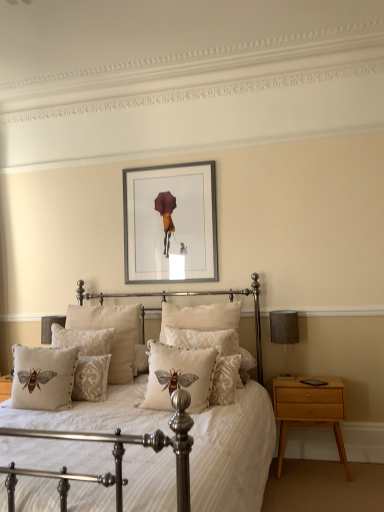
Question: Should I look upward or downward to see light brown wood nightstand at right?

Choices:
 (A) down
 (B) up

Answer: (A)

Question: Is matte white bed at center in front of beige embroidered pillow with bee design at center, which ranks as the 1th pillow in front-to-back order?

Choices:
 (A) yes
 (B) no

Answer: (A)

Question: From the image's perspective, would you say matte white bed at center is positioned over beige embroidered pillow with bee design at center, which ranks as the 1th pillow in front-to-back order?

Choices:
 (A) yes
 (B) no

Answer: (B)

Question: Is matte white bed at center shorter than beige embroidered pillow with bee design at center, which ranks as the 1th pillow in front-to-back order?

Choices:
 (A) no
 (B) yes

Answer: (A)

Question: Can you confirm if matte white bed at center is taller than beige embroidered pillow with bee design at center, which is the sixth pillow from back to front?

Choices:
 (A) no
 (B) yes

Answer: (B)

Question: Is matte white bed at center directly adjacent to beige embroidered pillow with bee design at center, which is the sixth pillow from back to front?

Choices:
 (A) no
 (B) yes

Answer: (A)

Question: Could beige embroidered pillow with bee design at center, which is the sixth pillow from back to front, be considered to be inside matte white bed at center?

Choices:
 (A) no
 (B) yes

Answer: (B)

Question: Considering the relative sizes of white textured pillow with bee design at center, the 3th pillow viewed from the front, and beige damask pillow with bee design at center, positioned as the 4th pillow in front-to-back order, in the image provided, is white textured pillow with bee design at center, the 3th pillow viewed from the front, smaller than beige damask pillow with bee design at center, positioned as the 4th pillow in front-to-back order,?

Choices:
 (A) no
 (B) yes

Answer: (B)

Question: Could you tell me if white textured pillow with bee design at center, the 3th pillow viewed from the front, is facing beige damask pillow with bee design at center, which is counted as the 3th pillow, starting from the back?

Choices:
 (A) yes
 (B) no

Answer: (A)

Question: From the image's perspective, is white textured pillow with bee design at center, the 3th pillow viewed from the front, over beige damask pillow with bee design at center, positioned as the 4th pillow in front-to-back order?

Choices:
 (A) no
 (B) yes

Answer: (A)

Question: Does white textured pillow with bee design at center, the 3th pillow viewed from the front, appear on the left side of beige damask pillow with bee design at center, positioned as the 4th pillow in front-to-back order?

Choices:
 (A) yes
 (B) no

Answer: (A)

Question: Does white textured pillow with bee design at center, the 3th pillow viewed from the front, have a lesser height compared to beige damask pillow with bee design at center, which is counted as the 3th pillow, starting from the back?

Choices:
 (A) no
 (B) yes

Answer: (B)

Question: Considering the relative sizes of white textured pillow with bee design at center, the 3th pillow viewed from the front, and beige damask pillow with bee design at center, which is counted as the 3th pillow, starting from the back, in the image provided, is white textured pillow with bee design at center, the 3th pillow viewed from the front, bigger than beige damask pillow with bee design at center, which is counted as the 3th pillow, starting from the back,?

Choices:
 (A) no
 (B) yes

Answer: (A)

Question: From the image's perspective, is silver metallic picture frame at upper center over beige embroidered cushion with bee design at center, acting as the second pillow starting from the front?

Choices:
 (A) no
 (B) yes

Answer: (B)